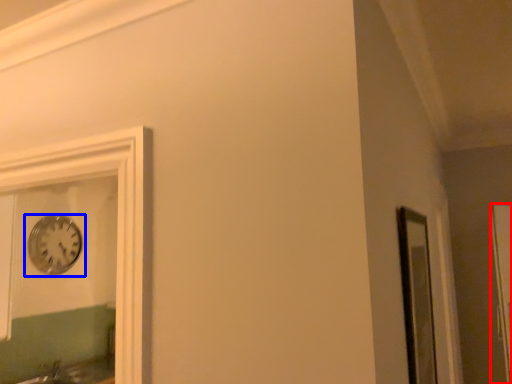
Question: Which object is further to the camera taking this photo, glass door (highlighted by a red box) or wall clock (highlighted by a blue box)?

Choices:
 (A) glass door
 (B) wall clock

Answer: (B)